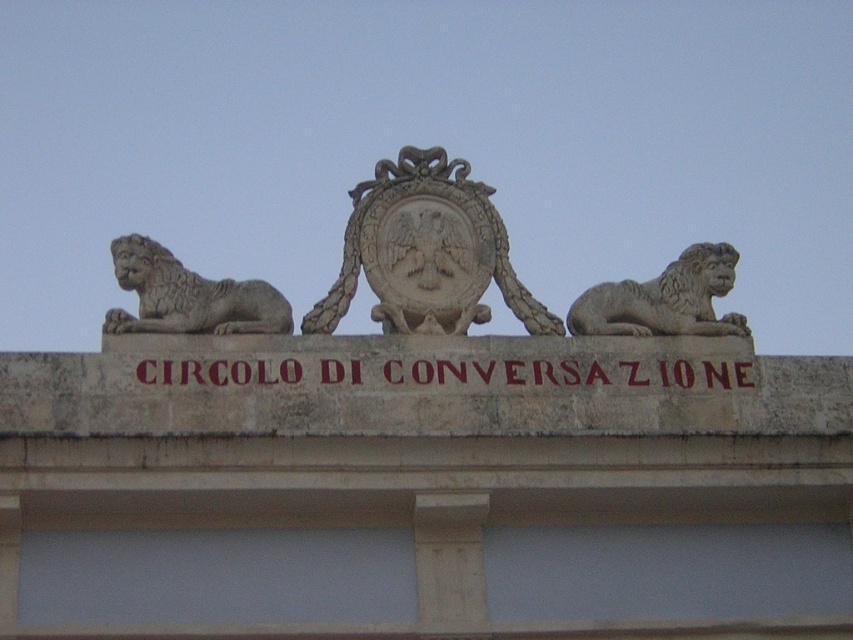
You are an architect examining the building facade. You notice a point at coordinates [426,252] on the image. What architectural element does this point correspond to?

The point at coordinates [426,252] corresponds to the stone coat of arms at center.

You are an architect examining the building facade. You need to determine which object, the brown stone sign at center or the gray stone lion at left, has a larger physical size. Based on the scene, which one is bigger?

The brown stone sign at center is bigger than the gray stone lion at left according to the description.

You are an architect examining the building facade. You notice the stone coat of arms at center and the brown stone sign at center. Which one is located to the left when viewed from the front?

The stone coat of arms at center is positioned on the left side of the brown stone sign at center, so it is located to the left when viewed from the front.